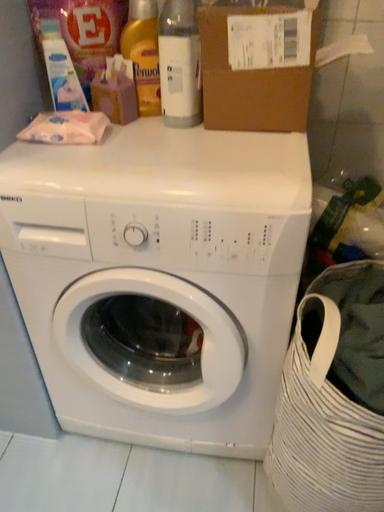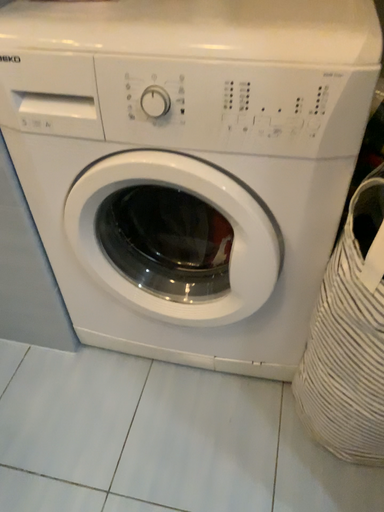
Question: Which way did the camera rotate in the video?

Choices:
 (A) rotated upward
 (B) rotated downward

Answer: (B)